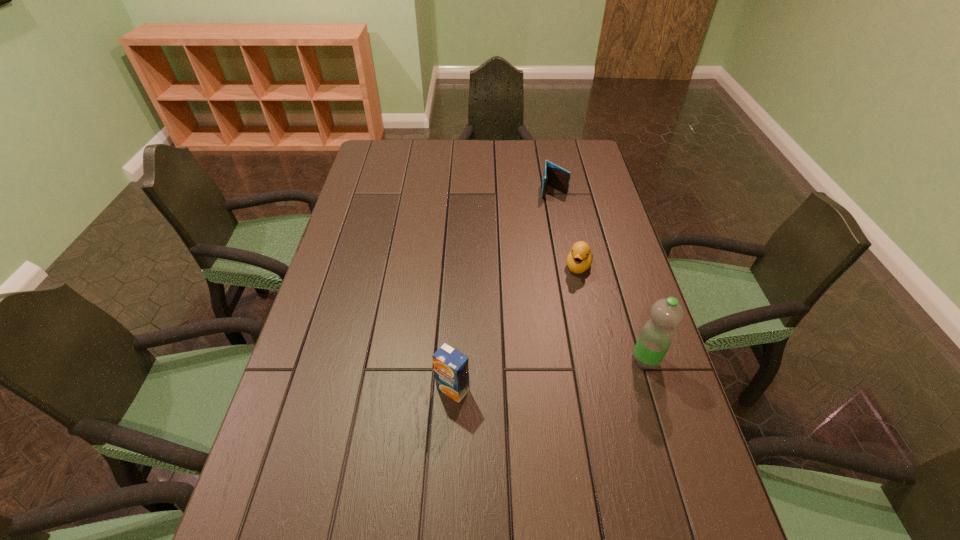
This screenshot has height=540, width=960. Find the location of `free space on the desktop that is between the third shortest object and the tallest object and is positioned on the exterior surface of the farthest object`. free space on the desktop that is between the third shortest object and the tallest object and is positioned on the exterior surface of the farthest object is located at coordinates (552, 374).

This screenshot has width=960, height=540. In order to click on vacant space on the desktop that is between the leftmost object and the rightmost object and is positioned on the face of the third nearest object in this screenshot , I will do `click(540, 376)`.